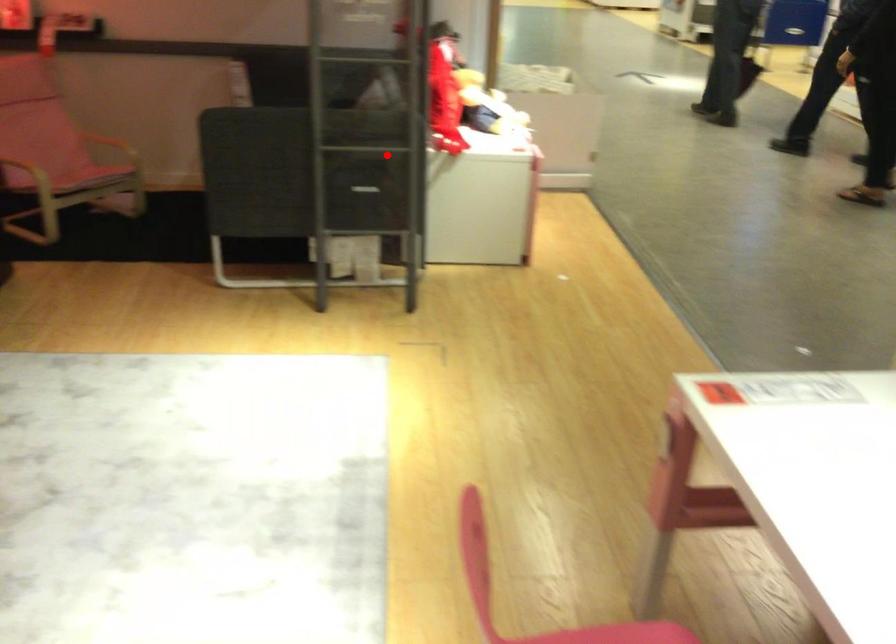
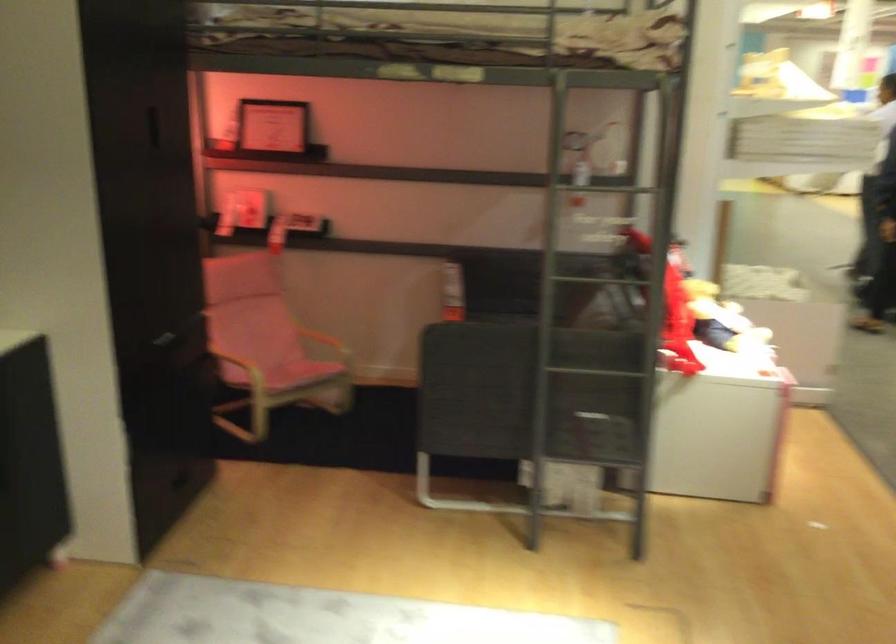
Where in the second image is the point corresponding to the highlighted location from the first image?

(610, 374)